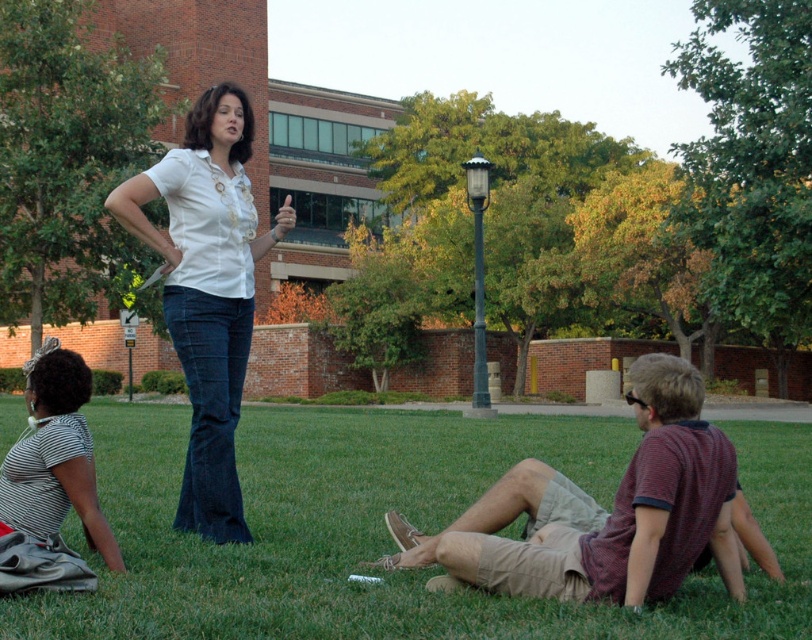
Between green grass at lower center and striped fabric shirt at lower left, which one has less height?

green grass at lower center is shorter.

Does green grass at lower center have a greater width compared to striped fabric shirt at lower left?

Yes.

Is point (163, 493) behind point (32, 424)?

That is True.

Where is `green grass at lower center`? green grass at lower center is located at coordinates (385, 529).

The height and width of the screenshot is (640, 812). Describe the element at coordinates (603, 513) in the screenshot. I see `striped cotton shirt at lower right` at that location.

Between point (720, 465) and point (24, 529), which one is positioned in front?

Positioned in front is point (720, 465).

Does point (638, 566) lie behind point (59, 372)?

No, (638, 566) is in front of (59, 372).

You are a GUI agent. You are given a task and a screenshot of the screen. Output one action in this format:
    pyautogui.click(x=<x>, y=<y>)
    Task: Click on the striped cotton shirt at lower right
    Image resolution: width=812 pixels, height=640 pixels.
    Given the screenshot: What is the action you would take?
    pyautogui.click(x=603, y=513)

Who is higher up, green grass at lower center or striped cotton shirt at lower right?

Positioned higher is striped cotton shirt at lower right.

Is green grass at lower center above striped cotton shirt at lower right?

No, green grass at lower center is not above striped cotton shirt at lower right.

Is point (361, 490) positioned behind point (657, 504)?

Yes.

Identify the location of green grass at lower center. The width and height of the screenshot is (812, 640). (385, 529).